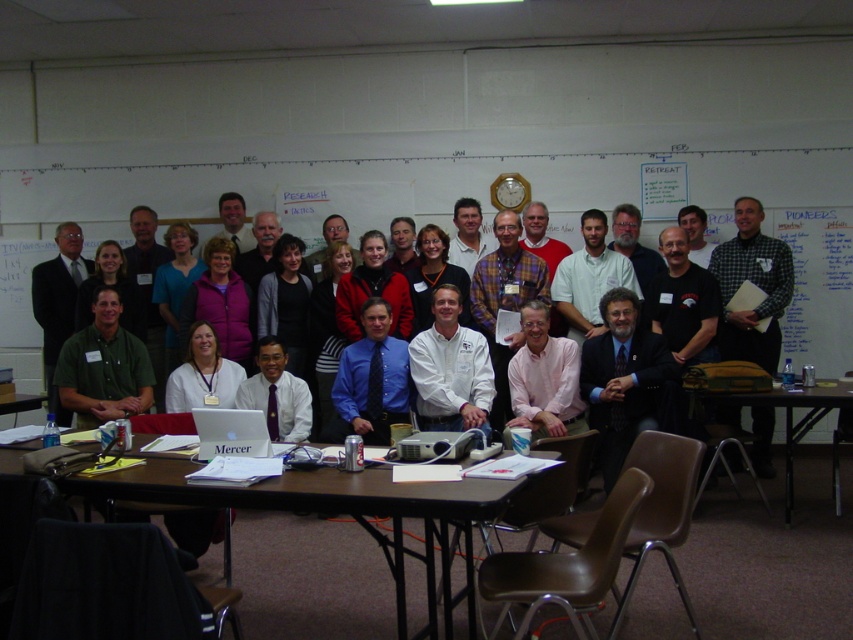
Question: Can you confirm if blue dress shirt at center is wider than green shirt at lower left?

Choices:
 (A) no
 (B) yes

Answer: (A)

Question: Can you confirm if silver metallic laptop at center is positioned to the right of brown wooden table at lower left?

Choices:
 (A) yes
 (B) no

Answer: (A)

Question: Which object is farther from the camera taking this photo?

Choices:
 (A) brown wooden table at lower left
 (B) white matte shirt at center
 (C) brown wood table at center
 (D) brown wooden table at lower right

Answer: (B)

Question: Does brown wood table at center lie in front of brown wooden table at lower left?

Choices:
 (A) no
 (B) yes

Answer: (B)

Question: Which point is farther to the camera?

Choices:
 (A) (642, 328)
 (B) (427, 417)
 (C) (827, 406)

Answer: (A)

Question: Which object is positioned farthest from the brown wood table at center?

Choices:
 (A) white matte shirt at center
 (B) silver metallic laptop at center
 (C) blue dress shirt at center

Answer: (C)